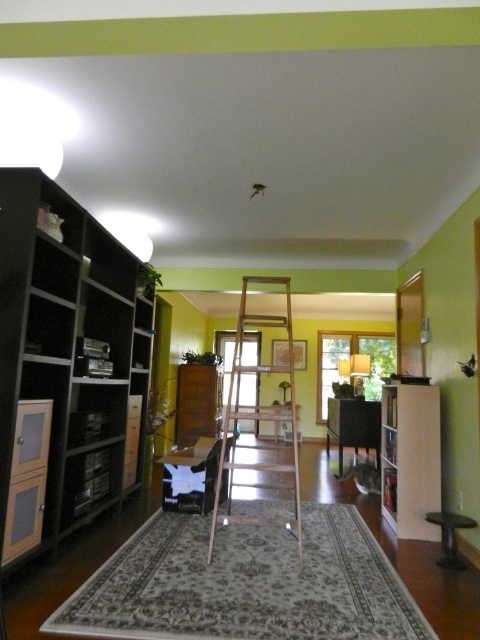
You are standing in the living room and want to reach a book on the top shelf of the built in shelving unit on the left. The wooden ladder at center is available. Can you use the ladder to reach the shelf?

The wooden ladder at center is 3.32 meters away from you, so you can walk to it and use it to reach the top shelf of the built in shelving unit on the left.

You are standing in the living room and want to place a new sofa that is 12 feet long. There is an open space at point (x=386, y=413). Can you fit the sofa there?

The distance of point (x=386, y=413) from viewer is 14.55 feet. Since the sofa is 12 feet long, it can fit in the available space as 12 feet is less than 14.55 feet.

You are standing in the center of the room and want to place a new book on the black matte bookshelf at left. According to the coordinates provided, in which direction should you move to reach it?

The black matte bookshelf at left is located at coordinates point (64,364), so you should move to the left side of the room to reach it.